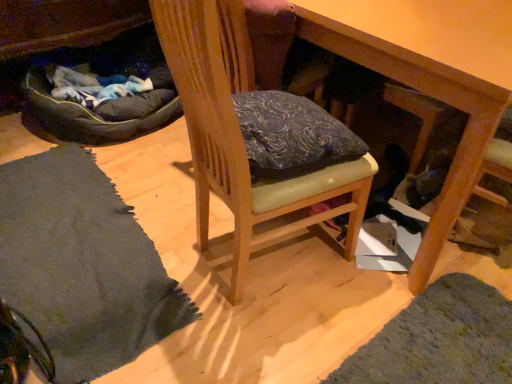
The width and height of the screenshot is (512, 384). Describe the element at coordinates (241, 135) in the screenshot. I see `wooden chair at center` at that location.

What do you see at coordinates (429, 76) in the screenshot?
I see `wooden table at center` at bounding box center [429, 76].

At what (x,y) coordinates should I click in order to perform the action: click on dark gray fabric bean bag at left. Please return your answer as a coordinate pair (x, y). Image resolution: width=512 pixels, height=384 pixels. Looking at the image, I should click on (97, 113).

Who is more distant, wooden chair at center or wooden table at center?

wooden table at center is further away from the camera.

Who is shorter, wooden chair at center or wooden table at center?

wooden table at center is shorter.

Is wooden table at center surrounded by wooden chair at center?

No, wooden table at center is not a part of wooden chair at center.

Considering the relative positions of dark gray fabric bean bag at left and wooden chair at center in the image provided, is dark gray fabric bean bag at left to the right of wooden chair at center from the viewer's perspective?

No, dark gray fabric bean bag at left is not to the right of wooden chair at center.

Between dark gray fabric bean bag at left and wooden chair at center, which one has larger width?

dark gray fabric bean bag at left.

Between point (96, 116) and point (346, 257), which one is positioned in front?

The point (346, 257) is closer to the camera.

From a real-world perspective, which is physically above, dark gray fabric bean bag at left or wooden chair at center?

wooden chair at center.

Is the depth of wooden table at center greater than that of soft gray rug at lower left?

Yes, the depth of wooden table at center is greater than that of soft gray rug at lower left.

Is soft gray rug at lower left surrounded by wooden table at center?

No, soft gray rug at lower left is not inside wooden table at center.

Find the location of a particular element. table behind the soft gray rug at lower left is located at coordinates (429, 76).

Does wooden chair at center touch dark gray fabric bean bag at left?

There is a gap between wooden chair at center and dark gray fabric bean bag at left.

Who is more distant, wooden chair at center or dark gray fabric bean bag at left?

Positioned behind is dark gray fabric bean bag at left.

Consider the image. Measure the distance between wooden chair at center and dark gray fabric bean bag at left.

1.08 meters.

Between wooden chair at center and dark gray fabric bean bag at left, which one has larger width?

dark gray fabric bean bag at left.

Is dark gray fabric bean bag at left shorter than soft gray rug at lower left?

Yes.

Is dark gray fabric bean bag at left aimed at soft gray rug at lower left?

Yes, dark gray fabric bean bag at left faces towards soft gray rug at lower left.

Does dark gray fabric bean bag at left have a greater width compared to soft gray rug at lower left?

Yes.

Identify the location of chair above the soft gray rug at lower left (from the image's perspective). (241, 135).

Considering the relative positions of soft gray rug at lower left and wooden chair at center in the image provided, is soft gray rug at lower left to the left of wooden chair at center from the viewer's perspective?

Yes.

From the picture: Considering the relative sizes of soft gray rug at lower left and wooden chair at center in the image provided, is soft gray rug at lower left taller than wooden chair at center?

No.

From the image's perspective, which one is positioned lower, soft gray rug at lower left or wooden chair at center?

soft gray rug at lower left appears lower in the image.

In the scene shown: From the image's perspective, which object appears higher, wooden table at center or wooden chair at center?

From the image's view, wooden table at center is above.

In terms of width, does wooden table at center look wider or thinner when compared to wooden chair at center?

wooden table at center is wider than wooden chair at center.

Is point (417, 21) closer to viewer compared to point (361, 186)?

Yes, point (417, 21) is in front of point (361, 186).

Is wooden table at center taller or shorter than wooden chair at center?

Clearly, wooden table at center is shorter compared to wooden chair at center.

At what (x,y) coordinates should I click in order to perform the action: click on table that appears on the right of wooden chair at center. Please return your answer as a coordinate pair (x, y). This screenshot has height=384, width=512. Looking at the image, I should click on (429, 76).

Locate an element on the screen. The image size is (512, 384). bean bag chair on the left of wooden chair at center is located at coordinates (97, 113).

From the image, which object appears to be nearer to wooden table at center, dark gray fabric bean bag at left or soft gray rug at lower left?

The object closer to wooden table at center is soft gray rug at lower left.

When comparing their distances from wooden chair at center, does soft gray rug at lower left or wooden table at center seem further?

The object further to wooden chair at center is soft gray rug at lower left.

Based on their spatial positions, is dark gray fabric bean bag at left or wooden table at center further from wooden chair at center?

dark gray fabric bean bag at left is further to wooden chair at center.

Based on their spatial positions, is soft gray rug at lower left or wooden chair at center further from dark gray fabric bean bag at left?

wooden chair at center is further to dark gray fabric bean bag at left.

Based on their spatial positions, is soft gray rug at lower left or wooden chair at center further from wooden table at center?

soft gray rug at lower left lies further to wooden table at center than the other object.

Based on their spatial positions, is dark gray fabric bean bag at left or wooden chair at center further from wooden table at center?

Based on the image, dark gray fabric bean bag at left appears to be further to wooden table at center.

Looking at this image, which object lies nearer to the anchor point wooden table at center, wooden chair at center or dark gray fabric bean bag at left?

Among the two, wooden chair at center is located nearer to wooden table at center.

When comparing their distances from dark gray fabric bean bag at left, does wooden chair at center or wooden table at center seem further?

The object further to dark gray fabric bean bag at left is wooden table at center.

The width and height of the screenshot is (512, 384). In order to click on table located between soft gray rug at lower left and dark gray fabric bean bag at left in the depth direction in this screenshot , I will do pyautogui.click(x=429, y=76).

Where is `chair between soft gray rug at lower left and wooden table at center in the horizontal direction`? This screenshot has height=384, width=512. chair between soft gray rug at lower left and wooden table at center in the horizontal direction is located at coordinates (241, 135).

You are a GUI agent. You are given a task and a screenshot of the screen. Output one action in this format:
    pyautogui.click(x=<x>, y=<y>)
    Task: Click on the chair between soft gray rug at lower left and dark gray fabric bean bag at left in the front-back direction
    The image size is (512, 384).
    Given the screenshot: What is the action you would take?
    pyautogui.click(x=241, y=135)

The height and width of the screenshot is (384, 512). I want to click on chair situated between dark gray fabric bean bag at left and wooden table at center from left to right, so click(x=241, y=135).